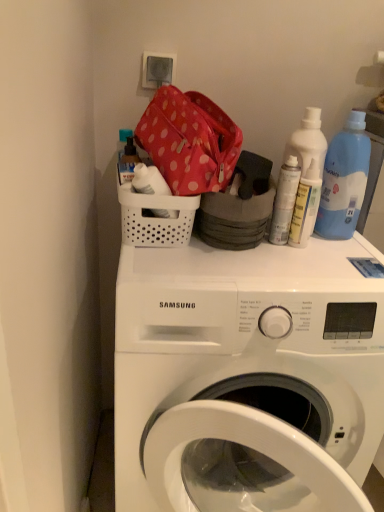
At what (x,y) coordinates should I click in order to perform the action: click on vacant space in front of translucent plastic spray can at upper right, the third bottle positioned from the left. Please return your answer as a coordinate pair (x, y). This screenshot has width=384, height=512. Looking at the image, I should click on (303, 271).